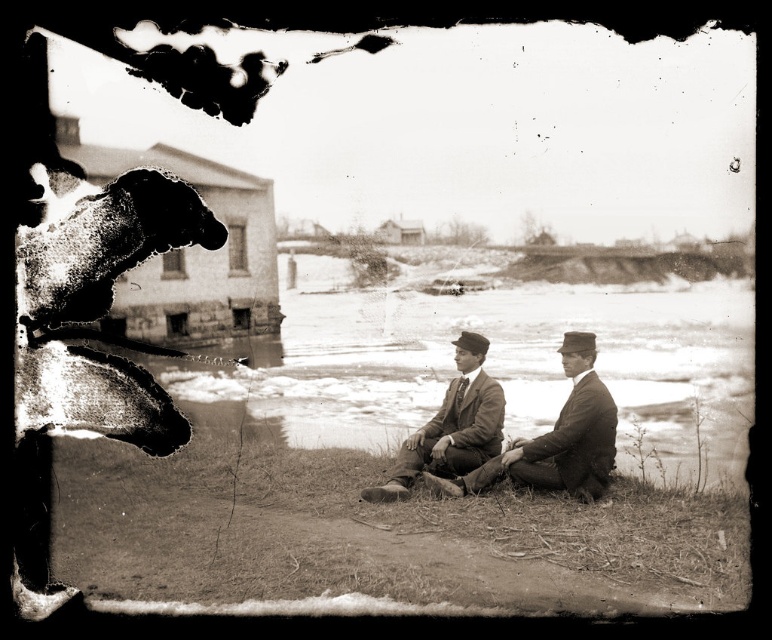
Question: Can you confirm if frothy white water at center is thinner than smooth brown suit at center?

Choices:
 (A) no
 (B) yes

Answer: (A)

Question: Which is farther from the smooth brown suit at center?

Choices:
 (A) frothy white water at center
 (B) brown leather jacket at center
 (C) smooth stone wall at left

Answer: (C)

Question: Which point appears closest to the camera in this image?

Choices:
 (A) (532, 480)
 (B) (391, 499)
 (C) (161, 211)
 (D) (417, 403)

Answer: (C)

Question: Can you confirm if frothy white water at center is positioned to the left of smooth stone wall at left?

Choices:
 (A) yes
 (B) no

Answer: (B)

Question: Can you confirm if frothy white water at center is smaller than brown leather jacket at center?

Choices:
 (A) yes
 (B) no

Answer: (B)

Question: Among these objects, which one is nearest to the camera?

Choices:
 (A) brown leather jacket at center
 (B) frothy white water at center
 (C) smooth stone wall at left

Answer: (C)